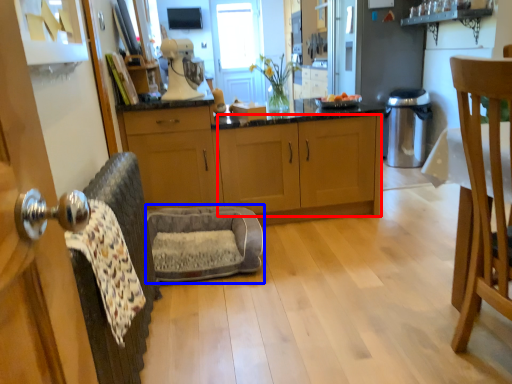
Question: Which object is further to the camera taking this photo, cabinetry (highlighted by a red box) or swivel chair (highlighted by a blue box)?

Choices:
 (A) cabinetry
 (B) swivel chair

Answer: (A)